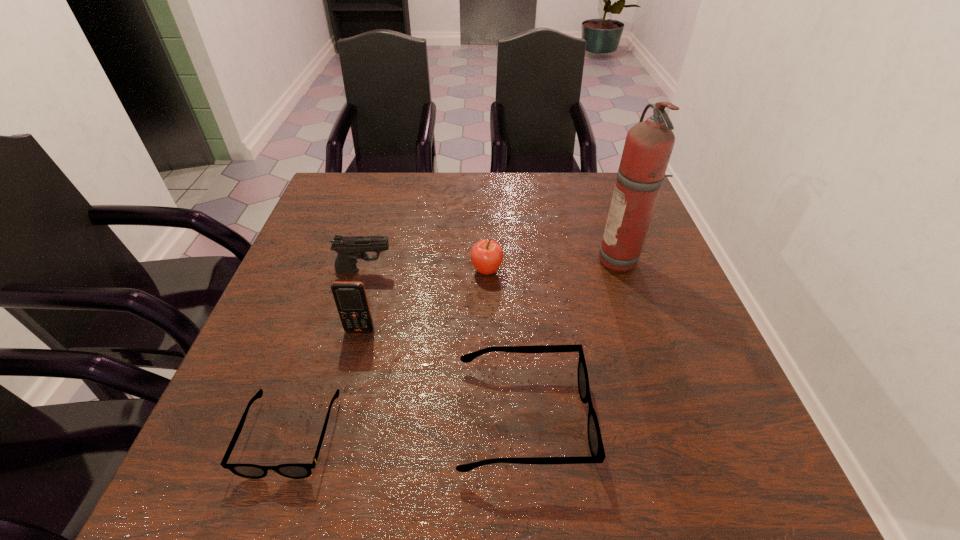
Observe the arrangement of all spectacless in the image. To keep them evenly spaced, where would you place another spectacles on the right? Please locate a free space. Please provide its 2D coordinates. Your answer should be formatted as a tuple, i.e. [(x, y)], where the tuple contains the x and y coordinates of a point satisfying the conditions above.

[(740, 403)]